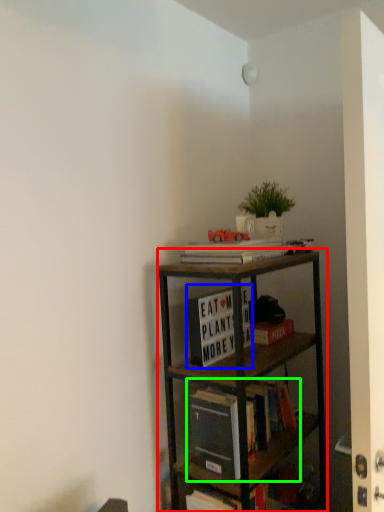
Question: Considering the real-world distances, which object is farthest from shelf (highlighted by a red box)? book (highlighted by a blue box) or book (highlighted by a green box)?

Choices:
 (A) book
 (B) book

Answer: (A)